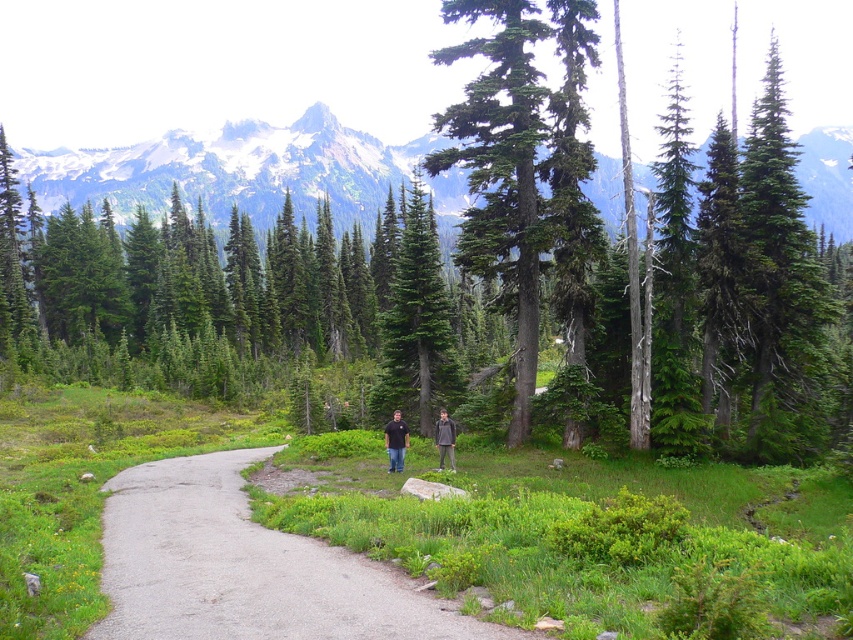
Question: Which point appears farthest from the camera in this image?

Choices:
 (A) (433, 378)
 (B) (430, 620)

Answer: (A)

Question: Among these objects, which one is nearest to the camera?

Choices:
 (A) green matte tree at center
 (B) dark gray jacket at center

Answer: (B)

Question: Is green matte tree at center bigger than black cotton shirt at center?

Choices:
 (A) yes
 (B) no

Answer: (A)

Question: Which of these objects is positioned closest to the dark gray jacket at center?

Choices:
 (A) gray asphalt trail at center
 (B) green matte tree at center
 (C) green coniferous forest at upper center

Answer: (A)

Question: Can you confirm if green matte tree at center is bigger than black cotton shirt at center?

Choices:
 (A) no
 (B) yes

Answer: (B)

Question: Considering the relative positions of gray asphalt trail at center and dark gray jacket at center in the image provided, where is gray asphalt trail at center located with respect to dark gray jacket at center?

Choices:
 (A) right
 (B) left

Answer: (B)